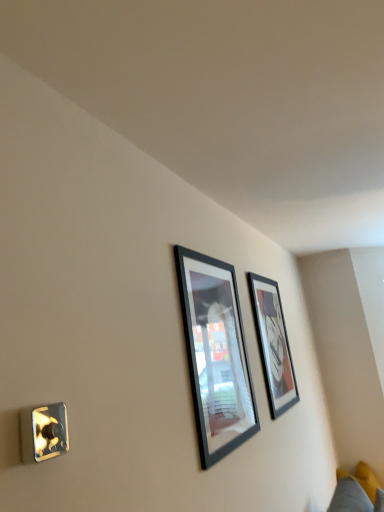
Question: From a real-world perspective, is matte black picture frame at upper center, which is the 1th picture frame in back-to-front order, above or below yellow fabric couch at lower right?

Choices:
 (A) above
 (B) below

Answer: (A)

Question: In terms of height, does matte black picture frame at upper center, which appears as the 2th picture frame when viewed from the front, look taller or shorter compared to yellow fabric couch at lower right?

Choices:
 (A) tall
 (B) short

Answer: (A)

Question: Based on their relative distances, which object is nearer to the matte black picture frame at upper center, the 2th picture frame from the left?

Choices:
 (A) black glossy picture frame at center, acting as the second picture frame starting from the right
 (B) yellow fabric couch at lower right

Answer: (A)

Question: Which object is positioned closest to the yellow fabric couch at lower right?

Choices:
 (A) matte black picture frame at upper center, positioned as the 1th picture frame in right-to-left order
 (B) black glossy picture frame at center, the second picture frame from the back

Answer: (A)